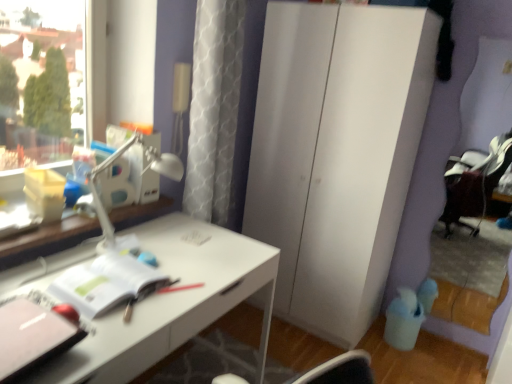
The width and height of the screenshot is (512, 384). Identify the location of empty space that is ontop of pink matte notebook at lower left, marked as the 2th notebook in a back-to-front arrangement (from a real-world perspective). (26, 325).